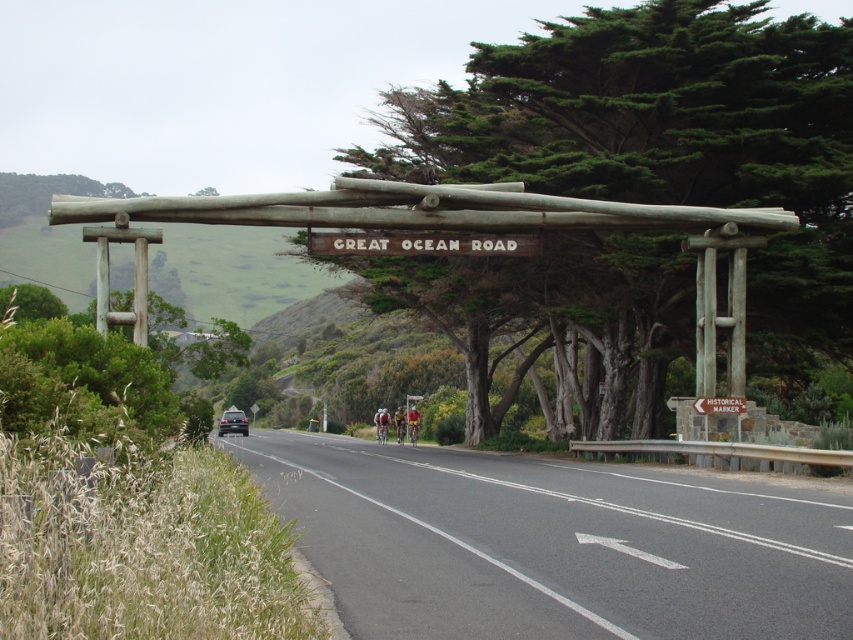
You are standing at the Great Ocean Road archway and want to take a photo of the road leading towards the horizon. You have two points marked on your camera screen at coordinates point [438,253] and point [227,413]. Which point should you focus on to capture the road that appears closer to the camera?

Point [438,253] is in front of point [227,413], so focusing on point [438,253] will capture the road section that is closer to the camera.

You are standing at the base of the rustic wooden archway on the Great Ocean Road. You want to walk to the black asphalt road at center. In which direction should you walk relative to the archway?

You should walk forward towards the black asphalt road at center because it is located directly ahead at the coordinates specified.

You are driving a shiny black sedan at center and want to continue on the road. According to the scene, is the black asphalt road at center ahead of your vehicle or behind it?

The black asphalt road at center is in front of the shiny black sedan at center, so the road is ahead of the vehicle.